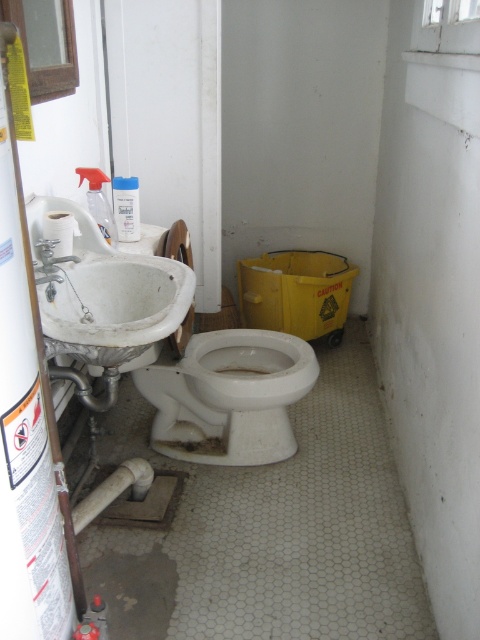
In the scene shown: You are standing in the bathroom and need to reach both the sink and the toilet paper roll. The sink is located at point [225,428] and the toilet paper roll is at point [100,275]. Which object is closer to you?

The sink at point [225,428] is closer to you than the toilet paper roll at point [100,275] because it is further to the viewer.

You are standing in the bathroom and need to locate the white matte toilet at center. According to the spatial description, where would you find it?

The white matte toilet at center is located at point (228, 396).